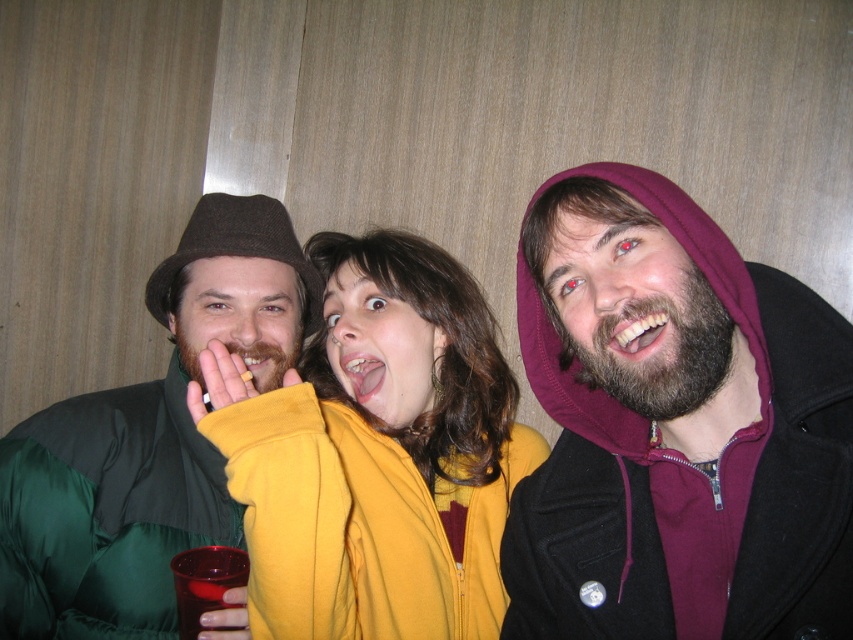
Between maroon hoodie at center and matte yellow teeth at center, which one has less height?

matte yellow teeth at center is shorter.

Is maroon hoodie at center bigger than matte yellow teeth at center?

Yes.

Between point (688, 284) and point (276, 352), which one is positioned in front?

Point (688, 284) is in front.

Locate an element on the screen. maroon hoodie at center is located at coordinates (675, 429).

Is yellow fleece jacket at center to the right of matte yellow teeth at center from the viewer's perspective?

Correct, you'll find yellow fleece jacket at center to the right of matte yellow teeth at center.

What do you see at coordinates (381, 458) in the screenshot?
I see `yellow fleece jacket at center` at bounding box center [381, 458].

This screenshot has height=640, width=853. Identify the location of yellow fleece jacket at center. pyautogui.click(x=381, y=458).

Is maroon hoodie at center positioned in front of yellow fleece jacket at center?

Yes, it is.

Is maroon hoodie at center to the right of yellow fleece jacket at center from the viewer's perspective?

Yes, maroon hoodie at center is to the right of yellow fleece jacket at center.

Is point (666, 396) in front of point (262, 602)?

Yes, point (666, 396) is in front of point (262, 602).

Identify the location of maroon hoodie at center. Image resolution: width=853 pixels, height=640 pixels. (675, 429).